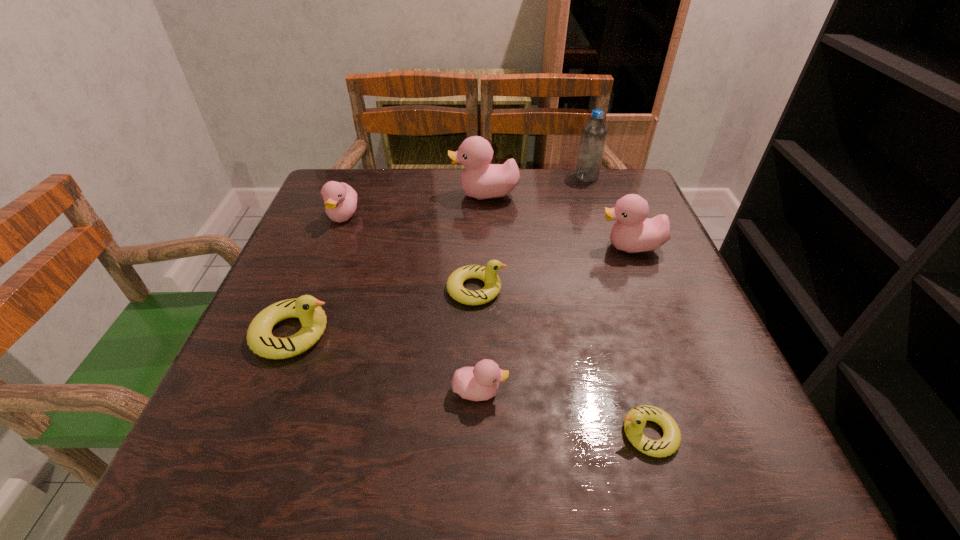
Identify the location of object positioned at the far left corner. [x=340, y=199].

You are a GUI agent. You are given a task and a screenshot of the screen. Output one action in this format:
    pyautogui.click(x=<x>, y=<y>)
    Task: Click on the object that is at the far right corner
    
    Given the screenshot: What is the action you would take?
    pyautogui.click(x=594, y=132)

Where is `object that is at the near right corner`? This screenshot has width=960, height=540. object that is at the near right corner is located at coordinates 635,420.

In the image, there is a desktop. Where is `vacant space at the far edge`? vacant space at the far edge is located at coordinates [x=568, y=218].

This screenshot has width=960, height=540. I want to click on free region at the near edge, so (x=361, y=487).

Where is `vacant space at the left edge of the desktop`? vacant space at the left edge of the desktop is located at coordinates (315, 223).

Find the location of a particular element. vacant area at the right edge of the desktop is located at coordinates (679, 264).

You are a GUI agent. You are given a task and a screenshot of the screen. Output one action in this format:
    pyautogui.click(x=<x>, y=<y>)
    Task: Click on the vacant region at the far left corner of the desktop
    Image resolution: width=960 pixels, height=540 pixels.
    Given the screenshot: What is the action you would take?
    pyautogui.click(x=353, y=183)

Image resolution: width=960 pixels, height=540 pixels. In the image, there is a desktop. What are the coordinates of `blank space at the near left corner` in the screenshot? It's located at (196, 469).

Where is `free region at the far right corner of the desktop`? free region at the far right corner of the desktop is located at coordinates (603, 171).